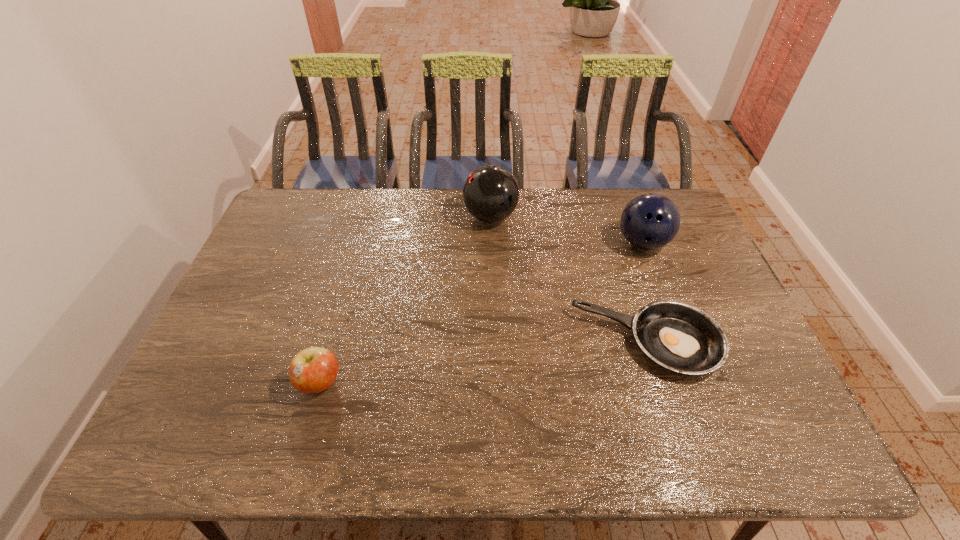
This screenshot has height=540, width=960. Find the location of `free space between the left bowling ball and the right bowling ball`. free space between the left bowling ball and the right bowling ball is located at coordinates (566, 230).

I want to click on empty space that is in between the left bowling ball and the right bowling ball, so click(x=566, y=230).

Image resolution: width=960 pixels, height=540 pixels. Find the location of `vacant space that's between the shortest object and the leftmost object`. vacant space that's between the shortest object and the leftmost object is located at coordinates (484, 363).

You are a GUI agent. You are given a task and a screenshot of the screen. Output one action in this format:
    pyautogui.click(x=<x>, y=<y>)
    Task: Click on the unoccupied area between the second shortest object and the left bowling ball
    The image size is (960, 540).
    Given the screenshot: What is the action you would take?
    pyautogui.click(x=405, y=300)

You are a GUI agent. You are given a task and a screenshot of the screen. Output one action in this format:
    pyautogui.click(x=<x>, y=<y>)
    Task: Click on the vacant area that lies between the third object from right to left and the right bowling ball
    The height and width of the screenshot is (540, 960).
    Given the screenshot: What is the action you would take?
    pyautogui.click(x=566, y=230)

Locate an element on the screen. The image size is (960, 540). free area in between the leftmost object and the shortest object is located at coordinates (484, 363).

Find the location of a particular element. free space that is in between the third tallest object and the left bowling ball is located at coordinates (405, 300).

Locate an element on the screen. The image size is (960, 540). empty space between the second object from left to right and the shortest object is located at coordinates (569, 280).

Where is `vacant area between the third object from right to left and the right bowling ball`? The width and height of the screenshot is (960, 540). vacant area between the third object from right to left and the right bowling ball is located at coordinates (566, 230).

Choose which object is the third nearest neighbor to the second object from left to right. Please provide its 2D coordinates. Your answer should be formatted as a tuple, i.e. [(x, y)], where the tuple contains the x and y coordinates of a point satisfying the conditions above.

[(312, 370)]